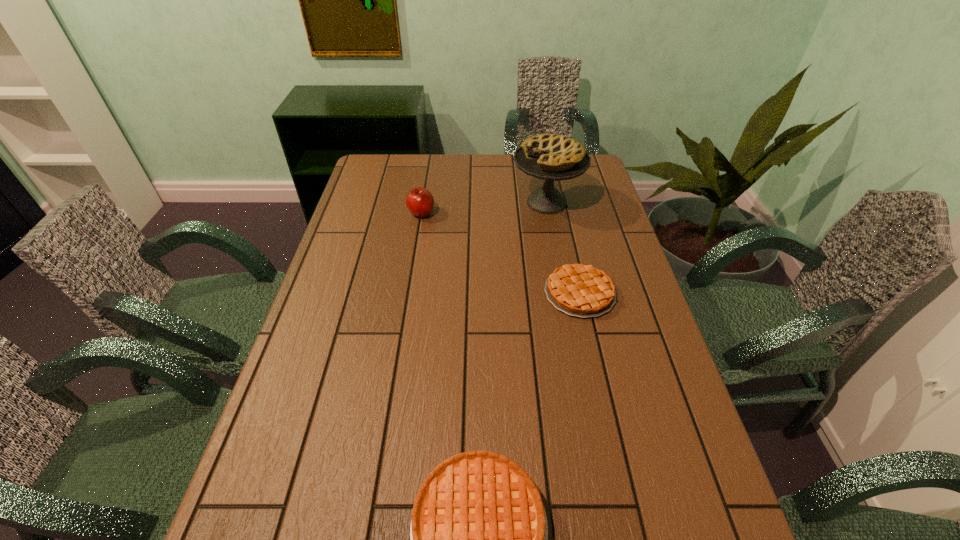
You are a GUI agent. You are given a task and a screenshot of the screen. Output one action in this format:
    pyautogui.click(x=<x>, y=<y>)
    Task: Click on the vacant area between the shortest object and the leftmost object
    The height and width of the screenshot is (540, 960).
    Given the screenshot: What is the action you would take?
    pyautogui.click(x=500, y=253)

The height and width of the screenshot is (540, 960). In order to click on free spot between the tallest object and the second farthest pie in this screenshot , I will do `click(564, 248)`.

Locate which object ranks third in proximity to the nearest pie. Please provide its 2D coordinates. Your answer should be formatted as a tuple, i.e. [(x, y)], where the tuple contains the x and y coordinates of a point satisfying the conditions above.

[(420, 202)]

Choose which object is the third nearest neighbor to the nearest object. Please provide its 2D coordinates. Your answer should be formatted as a tuple, i.e. [(x, y)], where the tuple contains the x and y coordinates of a point satisfying the conditions above.

[(420, 202)]

The width and height of the screenshot is (960, 540). In order to click on the closest pie to the second tallest object in this screenshot , I will do `click(550, 157)`.

You are a GUI agent. You are given a task and a screenshot of the screen. Output one action in this format:
    pyautogui.click(x=<x>, y=<y>)
    Task: Click on the pie that is the second closest to the third farthest object
    
    Given the screenshot: What is the action you would take?
    pyautogui.click(x=479, y=535)

The height and width of the screenshot is (540, 960). I want to click on free spot that satisfies the following two spatial constraints: 1. on the cut side of the tallest object; 2. on the left side of the shortest pie, so click(x=564, y=293).

Identify the location of vacant region that satisfies the following two spatial constraints: 1. on the cut side of the tallest pie; 2. on the back side of the shortest pie. (564, 293).

Find the location of a particular element. Image resolution: width=960 pixels, height=540 pixels. vacant point that satisfies the following two spatial constraints: 1. on the cut side of the third farthest object; 2. on the right side of the farthest pie is located at coordinates (564, 293).

Locate an element on the screen. The image size is (960, 540). free location that satisfies the following two spatial constraints: 1. on the back side of the shortest pie; 2. on the cut side of the tallest object is located at coordinates (560, 202).